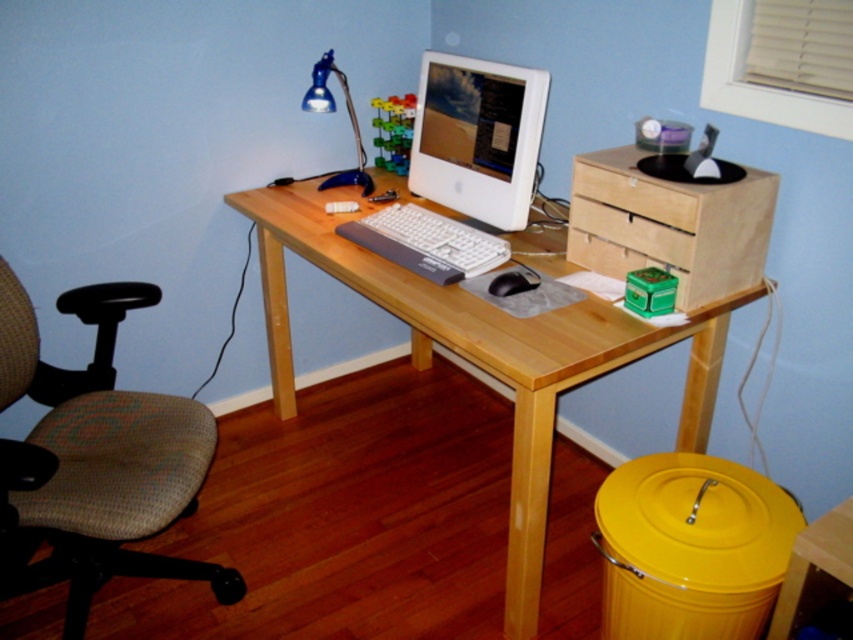
You are moving a beige fabric swivel chair at left and a blue plastic desk lamp at upper left into a narrow hallway. Which object should you move first to ensure they both fit through the doorway?

The blue plastic desk lamp at upper left is narrower than the beige fabric swivel chair at left, so you should move the blue plastic desk lamp at upper left first to ensure both fit through the doorway.

You are standing in front of the home office setup and want to reach a specific point marked at coordinates point (643,262). If your arm can extend 1.5 meters, can you comfortably reach that point without moving your feet?

The point (643,262) is 1.63 meters away from you, which is slightly beyond your arm reach of 1.5 meters. You would need to take a small step forward to comfortably reach it.

You are sitting in the beige office chair to the left of the desk. You need to reach the birch wood drawer at right which is 4.77 feet away. Can you comfortably reach it from your current position?

The birch wood drawer at right is 4.77 feet away from you, so yes, you can comfortably reach it from your current position in the beige office chair to the left of the desk.